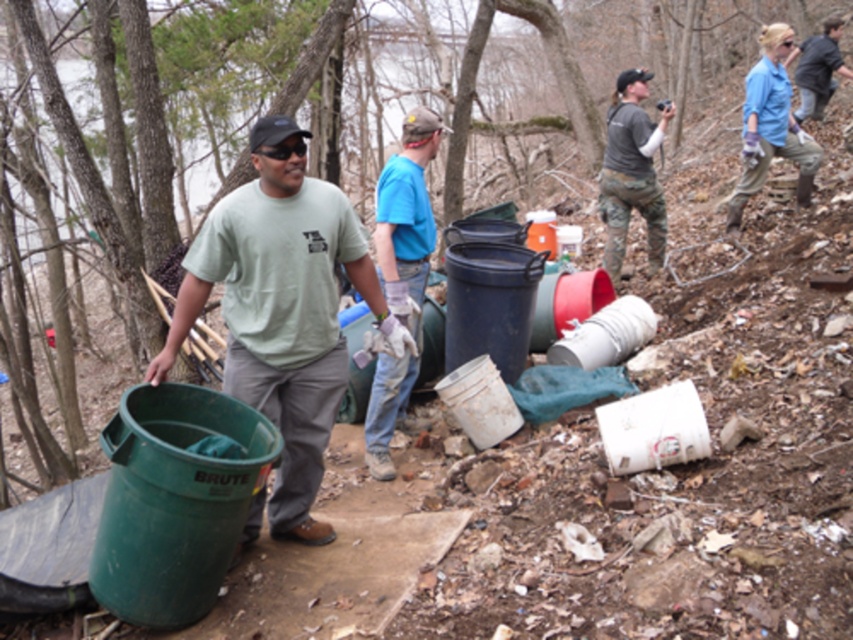
Question: Can you confirm if blue fabric shirt at center is positioned below blue cotton shirt at upper right?

Choices:
 (A) yes
 (B) no

Answer: (A)

Question: Is green matte bucket at left above dark gray jacket at upper right?

Choices:
 (A) yes
 (B) no

Answer: (B)

Question: Which object is positioned farthest from the blue fabric shirt at center?

Choices:
 (A) dark gray jacket at upper right
 (B) blue cotton shirt at upper right

Answer: (A)

Question: In this image, where is dark gray camouflage pants at center located relative to blue cotton shirt at upper right?

Choices:
 (A) below
 (B) above

Answer: (A)

Question: Which object is the closest to the green matte bucket at left?

Choices:
 (A) dark gray camouflage pants at center
 (B) dark gray jacket at upper right
 (C) blue cotton shirt at upper right

Answer: (A)

Question: Which of the following is the closest to the observer?

Choices:
 (A) (268, 192)
 (B) (814, 112)
 (C) (614, 257)

Answer: (A)